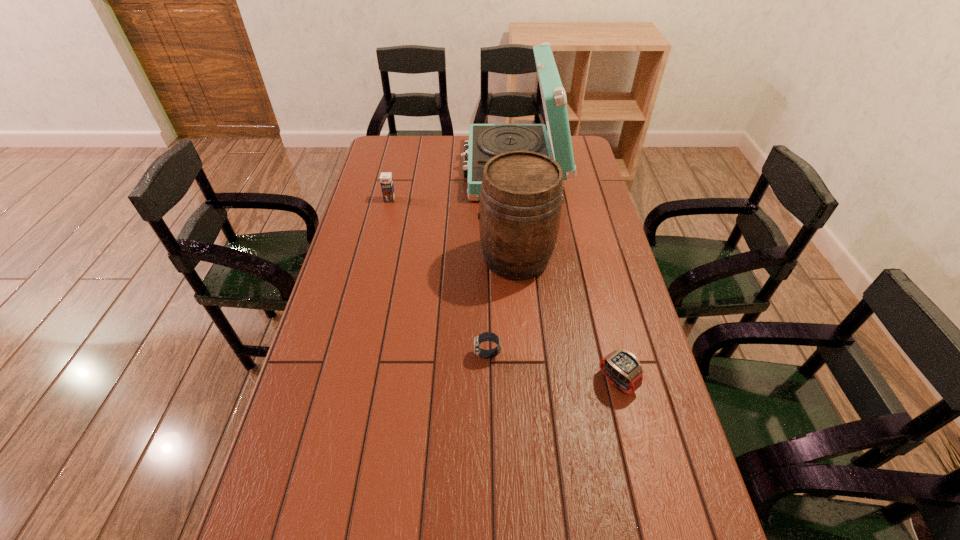
You are a GUI agent. You are given a task and a screenshot of the screen. Output one action in this format:
    pyautogui.click(x=<x>, y=<y>)
    Task: Click on the free space located on the face side of the tallest object
    The height and width of the screenshot is (540, 960).
    Given the screenshot: What is the action you would take?
    [406, 170]

Where is `free location located on the face side of the tallest object`? Image resolution: width=960 pixels, height=540 pixels. free location located on the face side of the tallest object is located at coordinates (398, 170).

This screenshot has width=960, height=540. I want to click on free spot located 0.230m on the side of the third nearest object near the bung hole, so click(409, 258).

Where is `free space located 0.210m on the side of the third nearest object near the bung hole`? free space located 0.210m on the side of the third nearest object near the bung hole is located at coordinates (415, 258).

Where is `free spot located 0.180m on the side of the third nearest object near the bung hole`? The width and height of the screenshot is (960, 540). free spot located 0.180m on the side of the third nearest object near the bung hole is located at coordinates (423, 258).

Find the location of a particular element. vacant area situated 0.400m on the front label of the third tallest object is located at coordinates (371, 279).

I want to click on vacant space located on the front of the nearest object, so [655, 534].

The width and height of the screenshot is (960, 540). Identify the location of vacant space located on the face of the farther watch. (444, 355).

You are a GUI agent. You are given a task and a screenshot of the screen. Output one action in this format:
    pyautogui.click(x=<x>, y=<y>)
    Task: Click on the blank space located on the face of the farther watch
    
    Given the screenshot: What is the action you would take?
    pyautogui.click(x=363, y=355)

Where is `vacant space situated on the face of the farther watch`? Image resolution: width=960 pixels, height=540 pixels. vacant space situated on the face of the farther watch is located at coordinates (393, 355).